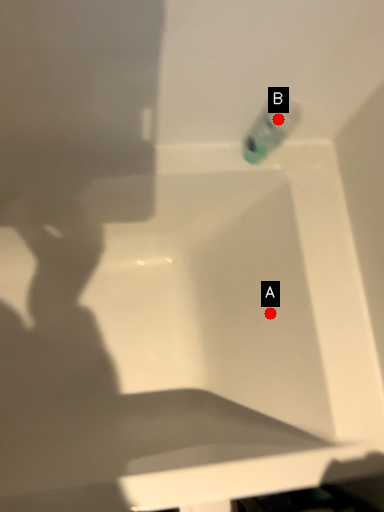
Question: Two points are circled on the image, labeled by A and B beside each circle. Among these points, which one is farthest from the camera?

Choices:
 (A) A is further
 (B) B is further

Answer: (A)